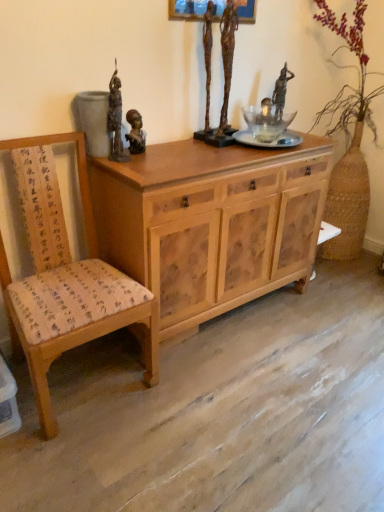
Locate an element on the screen. vacant area situated below wooden chair with fabric cushion at left (from a real-world perspective) is located at coordinates (94, 381).